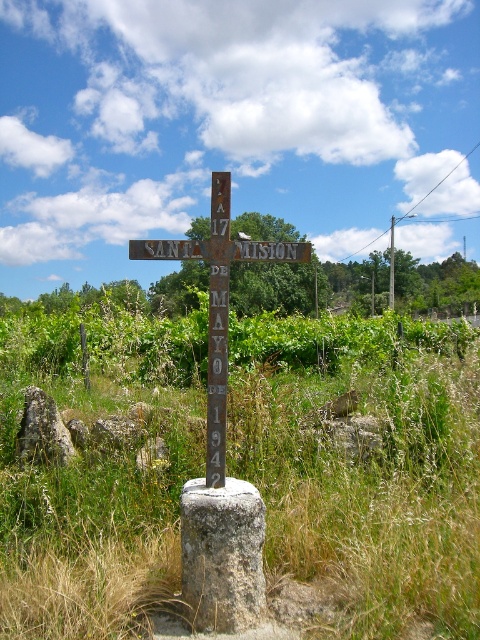
Looking at this image, does gray rough stone at center have a smaller size compared to rusty metal cross at center?

Indeed, gray rough stone at center has a smaller size compared to rusty metal cross at center.

Is gray rough stone at center to the right of rusty metal cross at center from the viewer's perspective?

No, gray rough stone at center is not to the right of rusty metal cross at center.

In order to click on gray rough stone at center in this screenshot , I will do tap(222, 556).

Which is below, gray rough stone at center or brown wooden pole at center?

gray rough stone at center is below.

Does point (226, 566) lie in front of point (392, 305)?

Yes.

What do you see at coordinates (222, 556) in the screenshot? The image size is (480, 640). I see `gray rough stone at center` at bounding box center [222, 556].

Locate an element on the screen. The height and width of the screenshot is (640, 480). gray rough stone at center is located at coordinates (222, 556).

Measure the distance between green grass at center and camera.

green grass at center is 14.67 feet away from camera.

Is point (466, 410) more distant than point (393, 273)?

No, it is not.

Is point (156, 588) farther from viewer compared to point (392, 273)?

No, (156, 588) is closer to viewer.

This screenshot has width=480, height=640. I want to click on green grass at center, so 363,467.